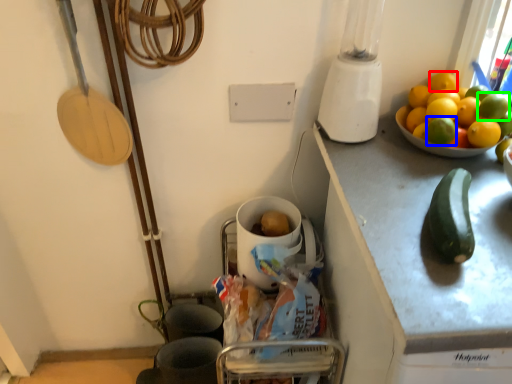
Question: Which object is positioned farthest from lemon (highlighted by a red box)? Select from lemon (highlighted by a blue box) and fruit (highlighted by a green box).

Choices:
 (A) lemon
 (B) fruit

Answer: (A)